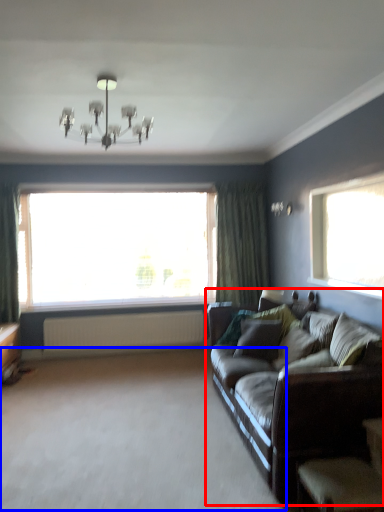
Question: Among these objects, which one is farthest to the camera, studio couch (highlighted by a red box) or plain (highlighted by a blue box)?

Choices:
 (A) studio couch
 (B) plain

Answer: (A)